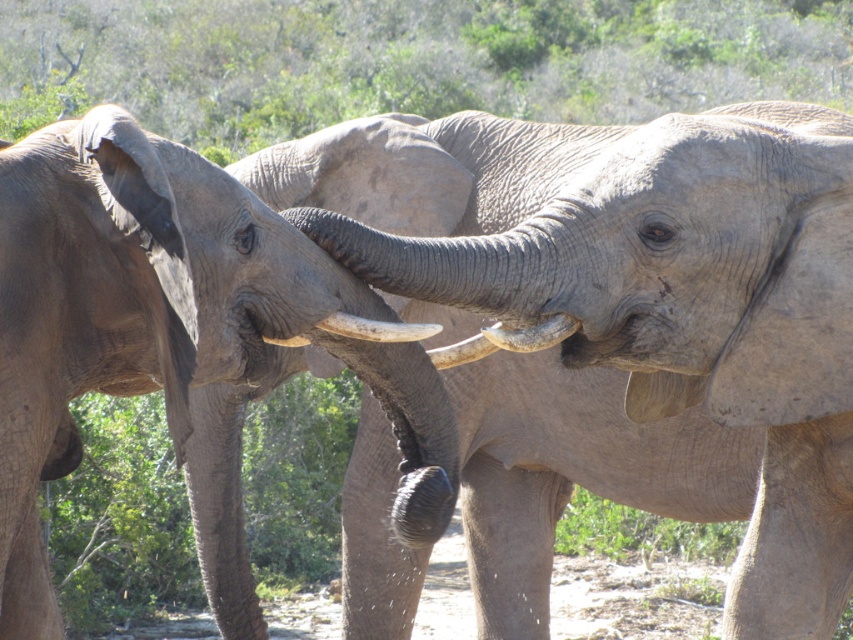
Between point (257, 362) and point (367, 320), which one is positioned behind?

Point (367, 320)

Does gray textured elephant at left appear on the left side of white smooth tusk at center?

Indeed, gray textured elephant at left is positioned on the left side of white smooth tusk at center.

Between point (39, 298) and point (379, 337), which one is positioned behind?

Point (379, 337)

At what (x,y) coordinates should I click in order to perform the action: click on gray textured elephant at left. Please return your answer as a coordinate pair (x, y). The width and height of the screenshot is (853, 640). Looking at the image, I should click on (160, 317).

Is gray textured elephant at center shorter than white smooth tusk at center?

No.

Is gray textured elephant at center bigger than white smooth tusk at center?

Indeed, gray textured elephant at center has a larger size compared to white smooth tusk at center.

Locate an element on the screen. Image resolution: width=853 pixels, height=640 pixels. gray textured elephant at center is located at coordinates (573, 472).

Which of these two, gray textured elephant at center or smooth ivory tusk at center, stands taller?

gray textured elephant at center

This screenshot has width=853, height=640. Describe the element at coordinates (573, 472) in the screenshot. I see `gray textured elephant at center` at that location.

Who is more forward, (x=648, y=470) or (x=285, y=340)?

Point (x=285, y=340) is more forward.

This screenshot has height=640, width=853. Identify the location of gray textured elephant at center. (573, 472).